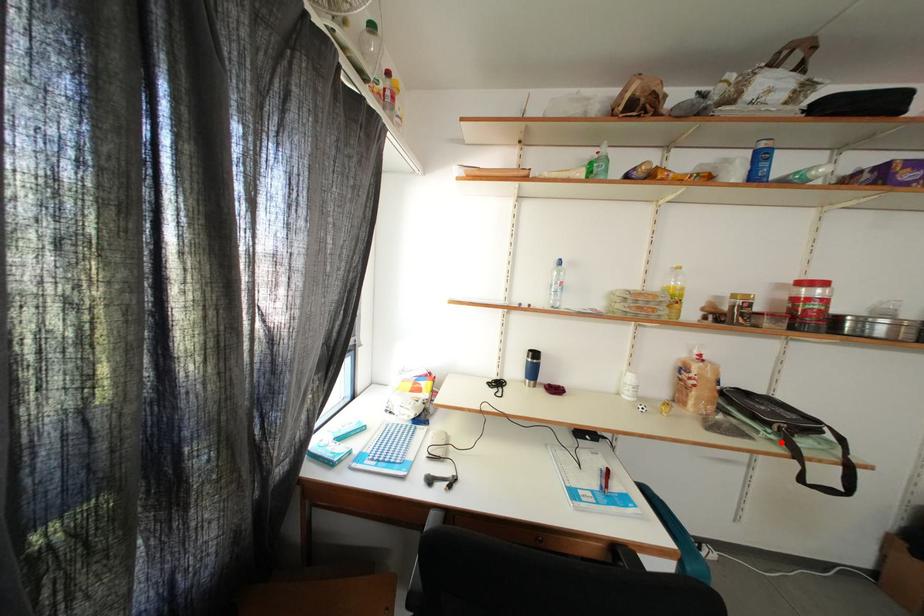
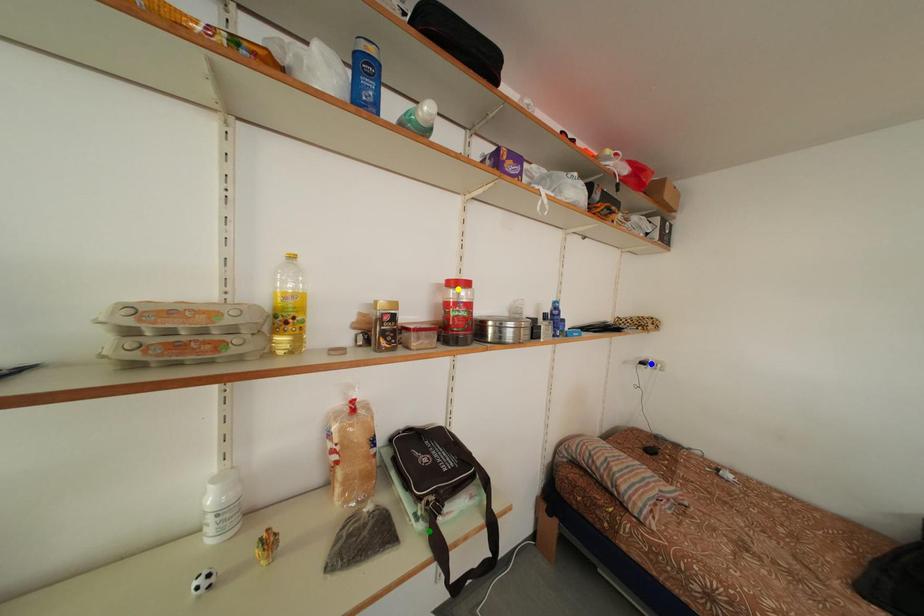
Question: I am providing you with two images of the same scene from different viewpoints. A red point is marked on the first image. You are given multiple points on the second image. Which mark in image 2 goes with the point in image 1?

Choices:
 (A) green point
 (B) blue point
 (C) yellow point

Answer: (A)